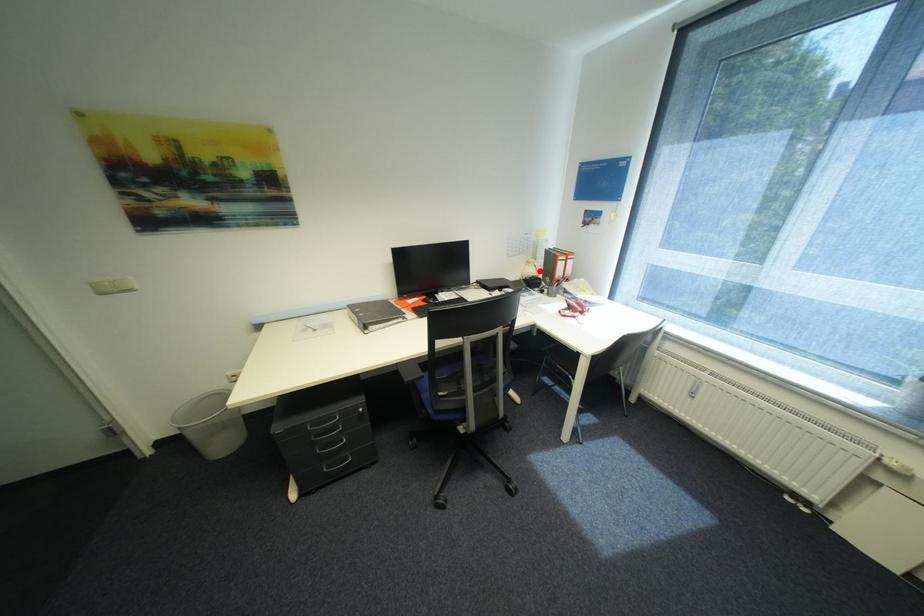
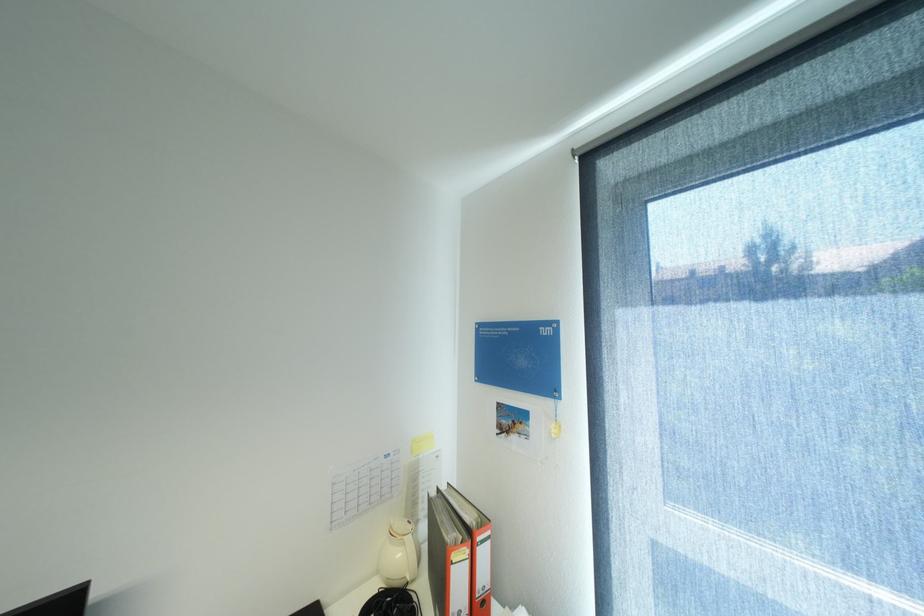
Where in the second image is the point corresponding to the highlighted location from the first image?

(407, 554)